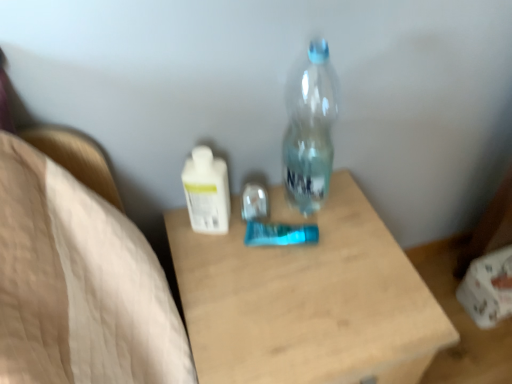
Question: Would you say wooden table at center is inside or outside transparent plastic bottle at center, which appears as the first bottle when viewed from the right?

Choices:
 (A) inside
 (B) outside

Answer: (B)

Question: Does point (388, 319) appear closer or farther from the camera than point (317, 150)?

Choices:
 (A) farther
 (B) closer

Answer: (B)

Question: Which object is the farthest from the wooden table at center?

Choices:
 (A) transparent plastic bottle at center, which appears as the first bottle when viewed from the right
 (B) white glossy lotion at center, the 1th bottle viewed from the left

Answer: (B)

Question: Based on their relative distances, which object is farther from the wooden table at center?

Choices:
 (A) transparent plastic bottle at center, which appears as the 2th bottle when viewed from the left
 (B) white glossy lotion at center, marked as the 2th bottle in a right-to-left arrangement

Answer: (B)